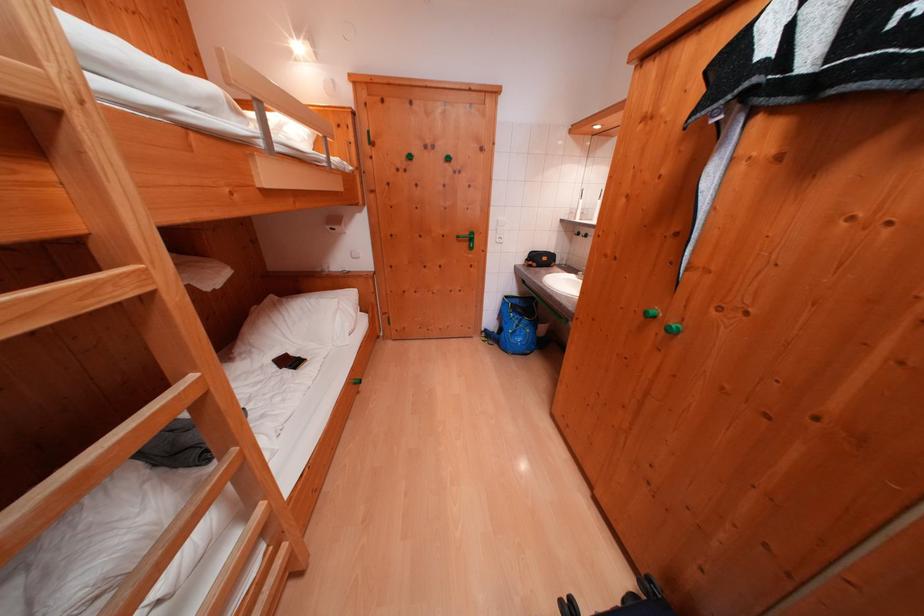
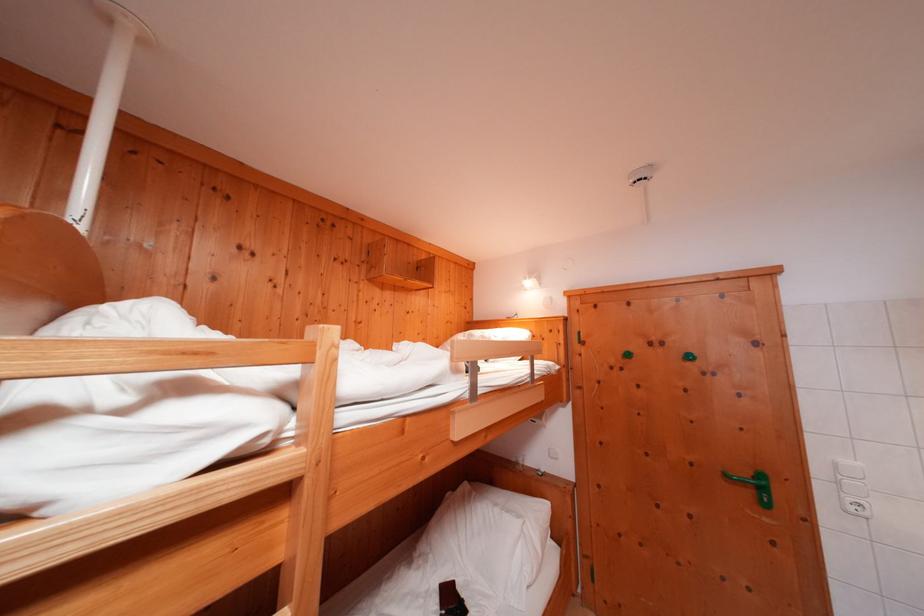
Find the pixel in the second image that matches (x=506, y=245) in the first image.

(858, 513)